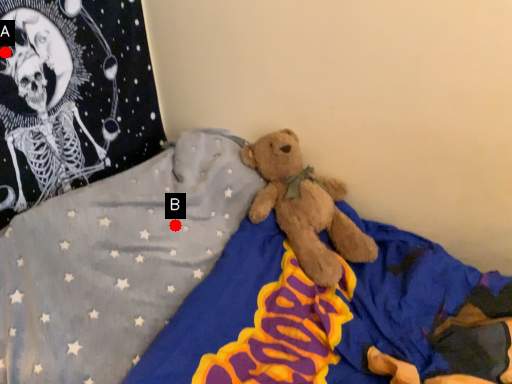
Question: Two points are circled on the image, labeled by A and B beside each circle. Which point appears closest to the camera in this image?

Choices:
 (A) A is closer
 (B) B is closer

Answer: (A)